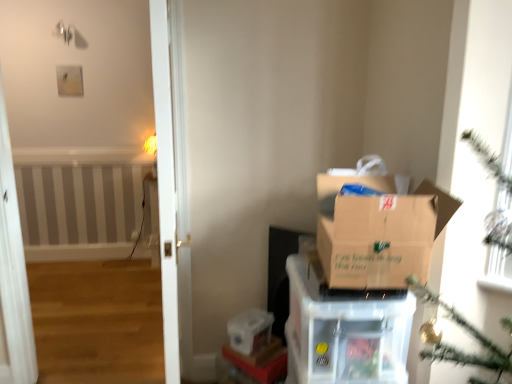
At what (x,y) coordinates should I click in order to perform the action: click on vacant space underneath clear plastic storage box at lower center (from a real-world perspective). Please return your answer as a coordinate pair (x, y). The width and height of the screenshot is (512, 384). Looking at the image, I should click on pyautogui.click(x=250, y=346).